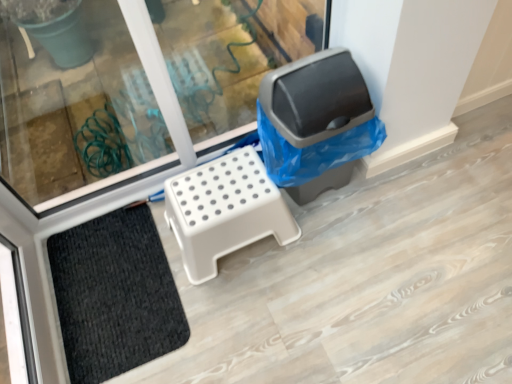
At what (x,y) coordinates should I click in order to perform the action: click on vacant space that is in between gray plastic recycling bin at right and white plastic step stool at center. Please return your answer as a coordinate pair (x, y). Looking at the image, I should click on (324, 213).